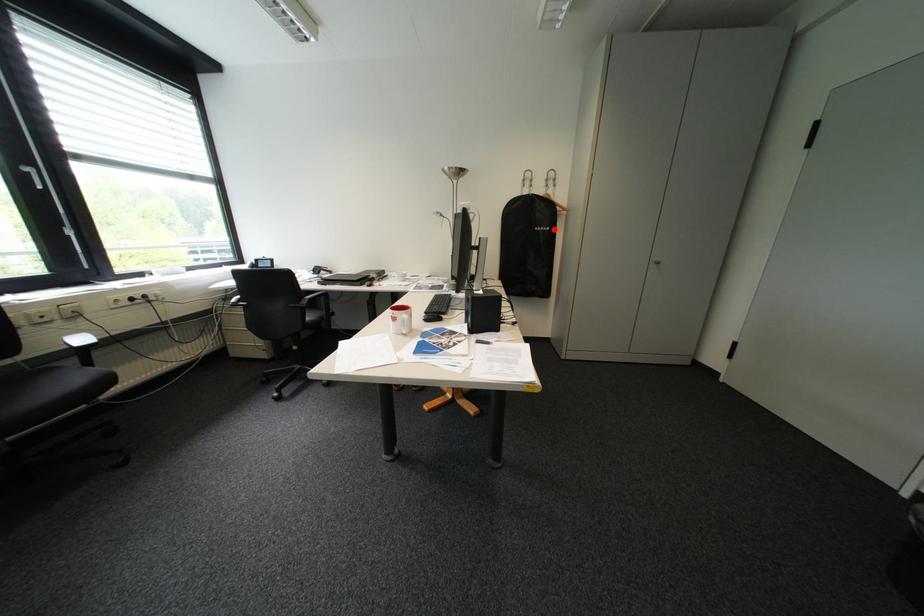
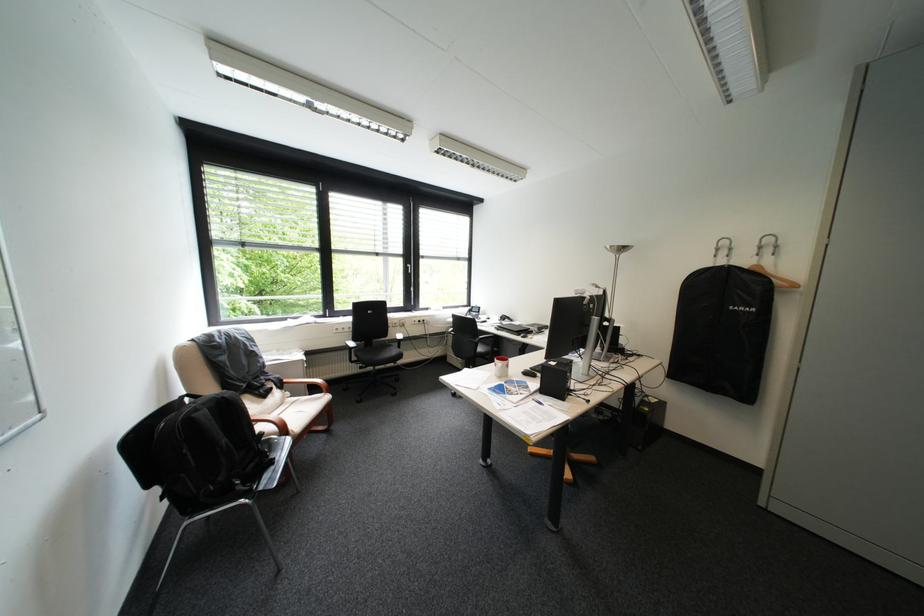
Locate, in the second image, the point that corresponds to the highlighted location in the first image.

(755, 309)